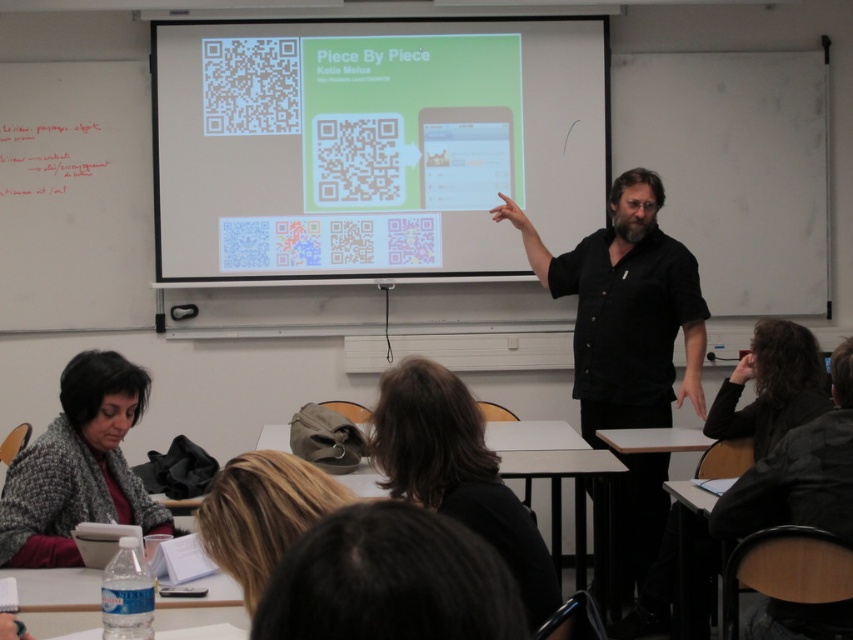
Consider the image. You are a student in the classroom and want to show your teacher the QR code on the screen. You are currently looking at the knitted gray sweater at lower left. Which direction should you turn to see the white matte qr code at upper center?

The white matte qr code at upper center is to the right of the knitted gray sweater at lower left, so you should turn to your right to see it.

You are a student in the classroom and want to scan the QR code on the projector screen using your smartphone. However, your smartphone is in your pocket, and you can only reach up to shoulder height. Can you scan the white matte qr code at upper center while wearing the black matte shirt at center?

The white matte qr code at upper center might be wider than black matte shirt at center, so it is possible that the QR code is wider and easier to scan from a lower angle. However, since the exact height isn